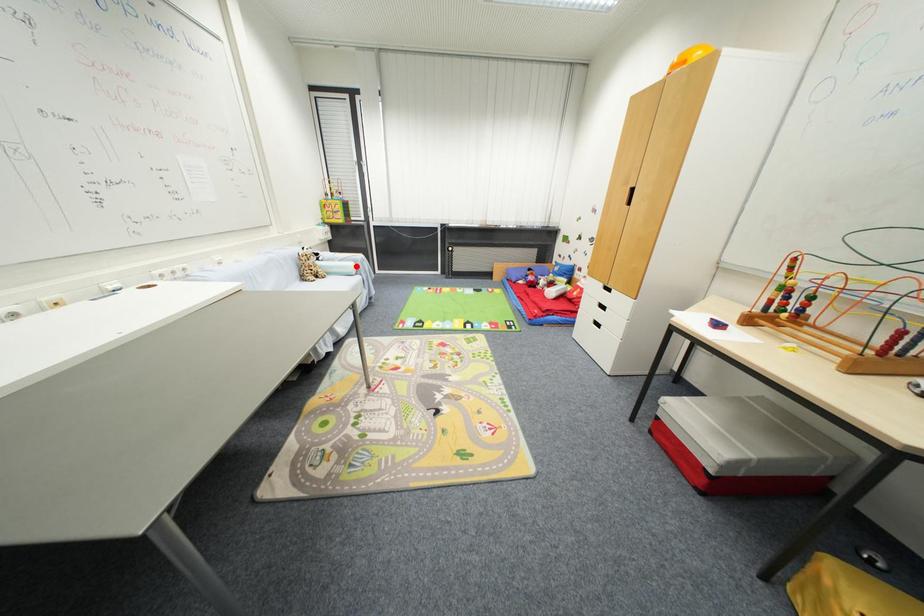
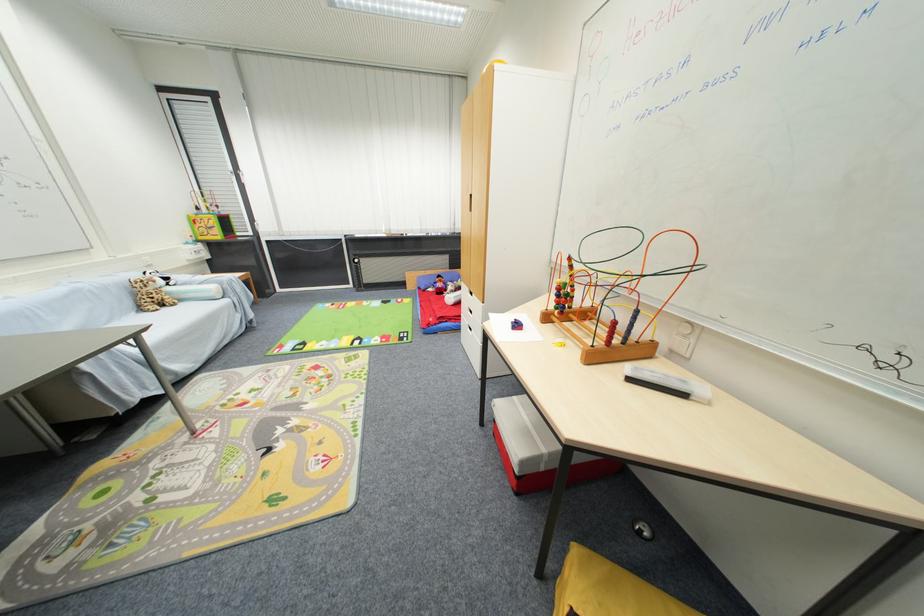
The point at the highlighted location is marked in the first image. Where is the corresponding point in the second image?

(217, 290)